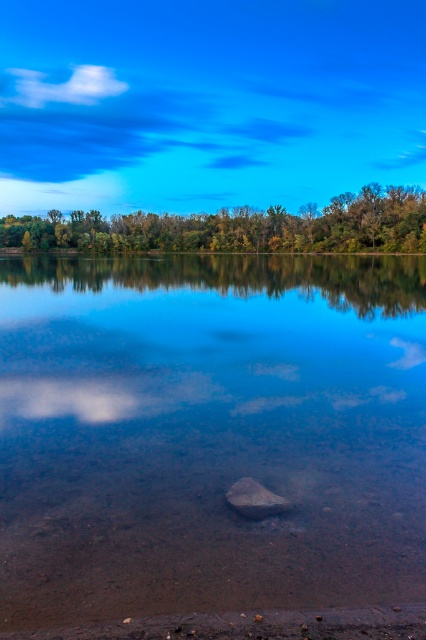
Who is shorter, white fluffy cloud at upper left or smooth brown rock at center?

Standing shorter between the two is smooth brown rock at center.

Between point (100, 80) and point (249, 488), which one is positioned behind?

The point (100, 80) is more distant.

Between point (29, 99) and point (253, 490), which one is positioned behind?

Positioned behind is point (29, 99).

Locate an element on the screen. The width and height of the screenshot is (426, 640). white fluffy cloud at upper left is located at coordinates (63, 86).

Is green leafy trees at upper center thinner than white fluffy cloud at upper left?

Incorrect, green leafy trees at upper center's width is not less than white fluffy cloud at upper left's.

Based on the photo, who is more distant from viewer, (333,204) or (75,74)?

The point (75,74) is behind.

Find the location of a particular element. This screenshot has height=640, width=426. green leafy trees at upper center is located at coordinates (239, 227).

Is clear glass water at center shorter than green leafy trees at upper center?

Correct, clear glass water at center is not as tall as green leafy trees at upper center.

Which of these two, clear glass water at center or green leafy trees at upper center, stands taller?

With more height is green leafy trees at upper center.

This screenshot has width=426, height=640. What are the coordinates of `clear glass water at center` in the screenshot? It's located at (209, 433).